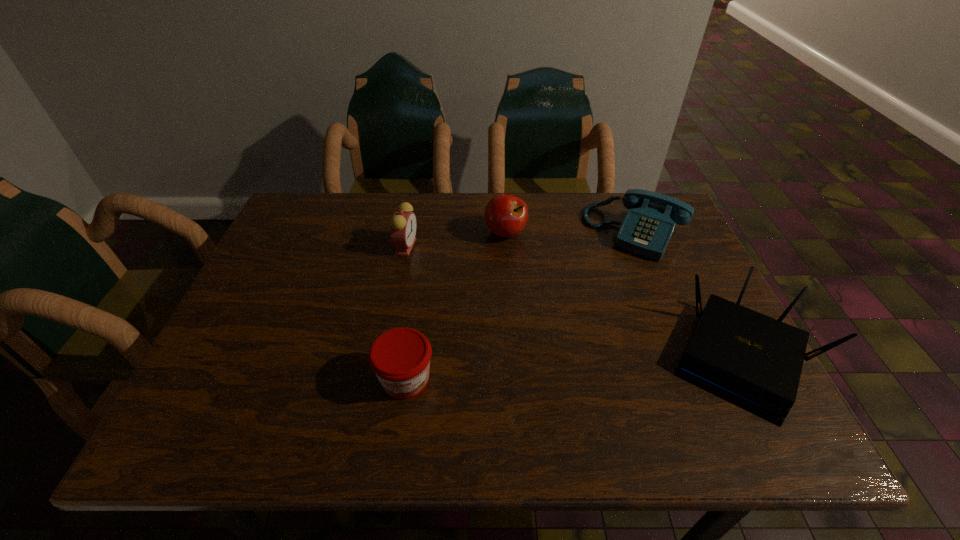
Image resolution: width=960 pixels, height=540 pixels. Find the location of `vacant space on the desktop that is between the jam and the router and is positioned on the face of the alarm clock`. vacant space on the desktop that is between the jam and the router and is positioned on the face of the alarm clock is located at coordinates click(540, 371).

I want to click on free space on the desktop that is between the jam and the router and is positioned on the stem of the third object from left to right, so click(536, 372).

Identify the location of free space on the desktop that is between the jam and the router and is positioned on the dial of the telephone. tap(556, 370).